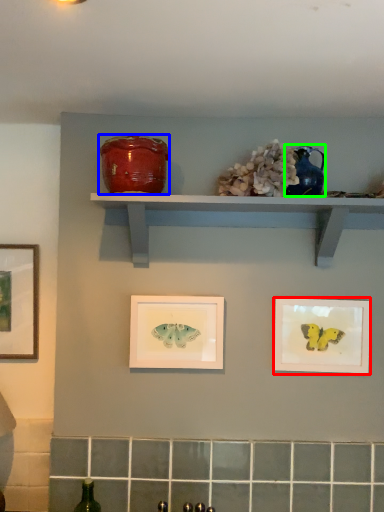
Question: Which object is positioned closest to picture frame (highlighted by a red box)? Select from pottery (highlighted by a blue box) and teal (highlighted by a green box).

Choices:
 (A) pottery
 (B) teal

Answer: (B)